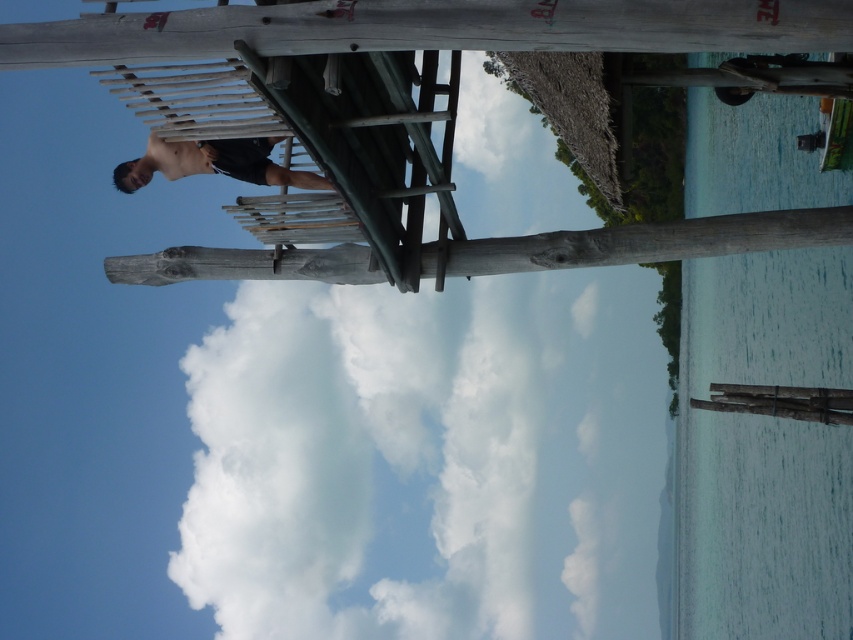
Question: Does natural wood beam at center have a lesser width compared to dark brown wood person at center?

Choices:
 (A) yes
 (B) no

Answer: (B)

Question: Is white fluffy cloud at upper center behind dark brown wood person at center?

Choices:
 (A) no
 (B) yes

Answer: (B)

Question: Which of these objects is positioned closest to the white fluffy cloud at upper center?

Choices:
 (A) dark brown wood person at center
 (B) natural wood beam at center

Answer: (A)

Question: Which of the following is the closest to the observer?

Choices:
 (A) (624, 228)
 (B) (169, 172)
 (C) (469, 292)

Answer: (A)

Question: Which of the following is the farthest from the observer?

Choices:
 (A) natural wood beam at center
 (B) white fluffy cloud at upper center
 (C) dark brown wood person at center

Answer: (B)

Question: Is natural wood beam at center positioned behind dark brown wood person at center?

Choices:
 (A) no
 (B) yes

Answer: (B)